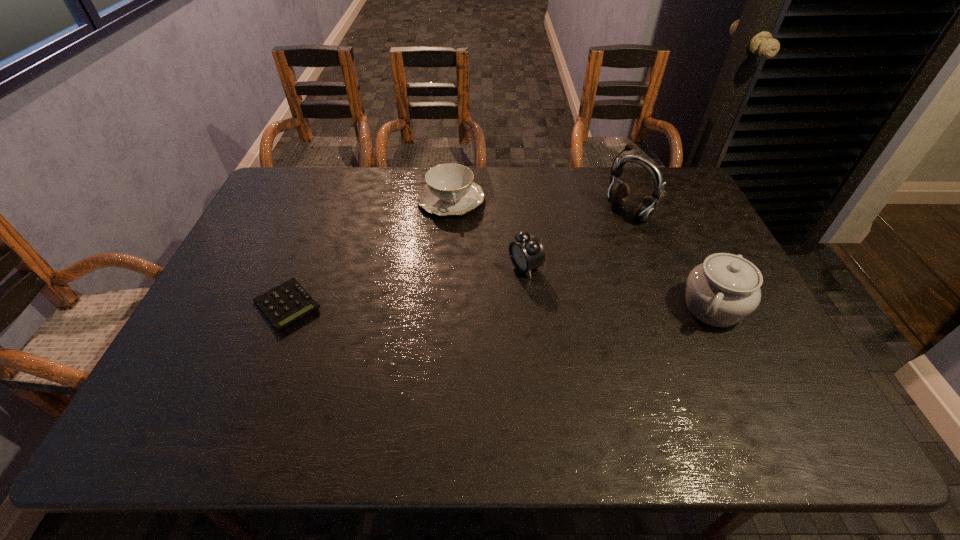
You are a GUI agent. You are given a task and a screenshot of the screen. Output one action in this format:
    pyautogui.click(x=<x>, y=<y>)
    Task: Click on the blank area located 0.270m on the back of the taller chinaware
    The height and width of the screenshot is (540, 960).
    Given the screenshot: What is the action you would take?
    pyautogui.click(x=671, y=221)

You are a GUI agent. You are given a task and a screenshot of the screen. Output one action in this format:
    pyautogui.click(x=<x>, y=<y>)
    Task: Click on the free space located 0.170m on the front side of the third tallest object
    
    Given the screenshot: What is the action you would take?
    pyautogui.click(x=460, y=300)

At what (x,y) coordinates should I click in order to perform the action: click on free location located 0.080m on the front side of the third tallest object. Please return your answer as a coordinate pair (x, y). Image resolution: width=960 pixels, height=540 pixels. Looking at the image, I should click on (488, 286).

The height and width of the screenshot is (540, 960). Find the location of `vacant region located on the front side of the third tallest object`. vacant region located on the front side of the third tallest object is located at coordinates (427, 316).

The width and height of the screenshot is (960, 540). I want to click on free point located on the ear pads of the earphone, so click(538, 269).

This screenshot has height=540, width=960. I want to click on free space located 0.210m on the ear pads of the earphone, so click(x=568, y=250).

The height and width of the screenshot is (540, 960). I want to click on vacant area situated on the ear pads of the earphone, so click(562, 254).

Identify the location of vacant space located 0.370m on the handle side of the farther chinaware. (476, 307).

You are a GUI agent. You are given a task and a screenshot of the screen. Output one action in this format:
    pyautogui.click(x=<x>, y=<y>)
    Task: Click on the vacant space located on the handle side of the farther chinaware
    
    Given the screenshot: What is the action you would take?
    pyautogui.click(x=466, y=262)

Where is `blank space located 0.170m on the handle side of the farther chinaware`? The height and width of the screenshot is (540, 960). blank space located 0.170m on the handle side of the farther chinaware is located at coordinates (464, 255).